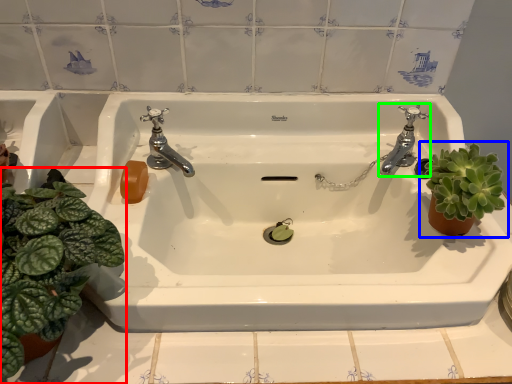
Question: Which object is the closest to the houseplant (highlighted by a red box)? Choose among these: houseplant (highlighted by a blue box) or tap (highlighted by a green box).

Choices:
 (A) houseplant
 (B) tap

Answer: (A)